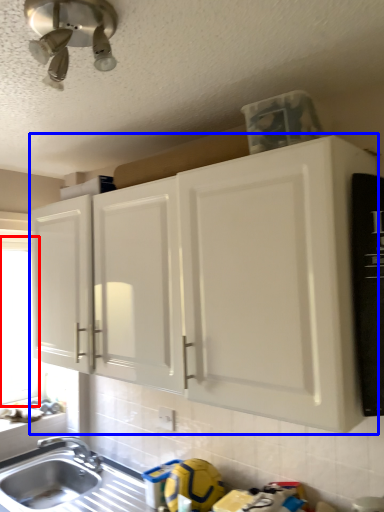
Question: Among these objects, which one is farthest to the camera, window screen (highlighted by a red box) or cabinetry (highlighted by a blue box)?

Choices:
 (A) window screen
 (B) cabinetry

Answer: (A)